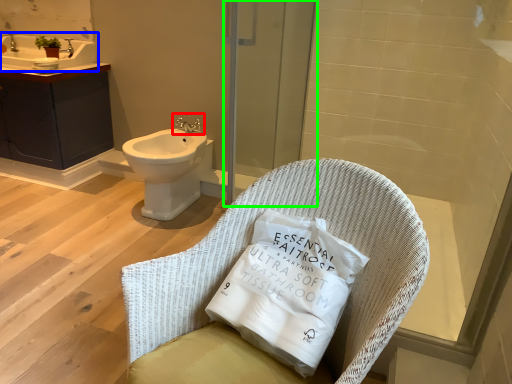
Question: Which object is the closest to the tap (highlighted by a red box)? Choose among these: sink (highlighted by a blue box) or screen door (highlighted by a green box).

Choices:
 (A) sink
 (B) screen door

Answer: (B)